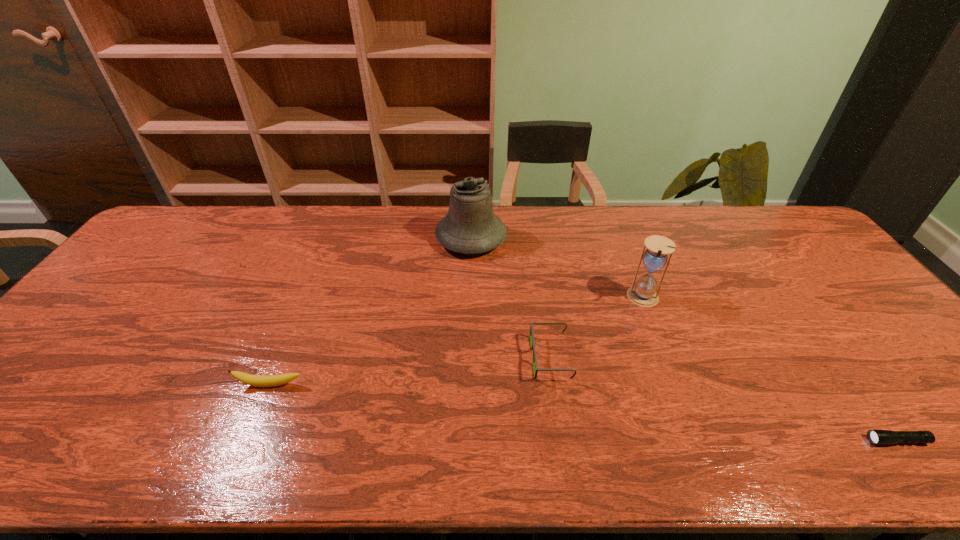
Find the location of a particular element. the second object from left to right is located at coordinates (470, 227).

Identify the location of the farthest object. The width and height of the screenshot is (960, 540). (470, 227).

Where is `the second farthest object`? This screenshot has width=960, height=540. the second farthest object is located at coordinates (x=643, y=293).

Locate an element on the screen. This screenshot has width=960, height=540. the second object from right to left is located at coordinates (643, 293).

Find the location of a particular element. banana is located at coordinates pyautogui.click(x=254, y=380).

You are a GUI agent. You are given a task and a screenshot of the screen. Output one action in this format:
    pyautogui.click(x=<x>, y=<y>)
    Task: Click on the spectacles
    The image size is (960, 540).
    Given the screenshot: What is the action you would take?
    pyautogui.click(x=532, y=342)

The width and height of the screenshot is (960, 540). What are the coordinates of `the shortest object` in the screenshot? It's located at (877, 437).

Identify the location of the rightmost object. The image size is (960, 540). (877, 437).

Identify the location of free space located 0.250m on the right of the fourth object from right to left. The height and width of the screenshot is (540, 960). (582, 238).

Find the location of a particular element. This screenshot has height=540, width=960. vacant space located 0.090m on the right of the second farthest object is located at coordinates (690, 298).